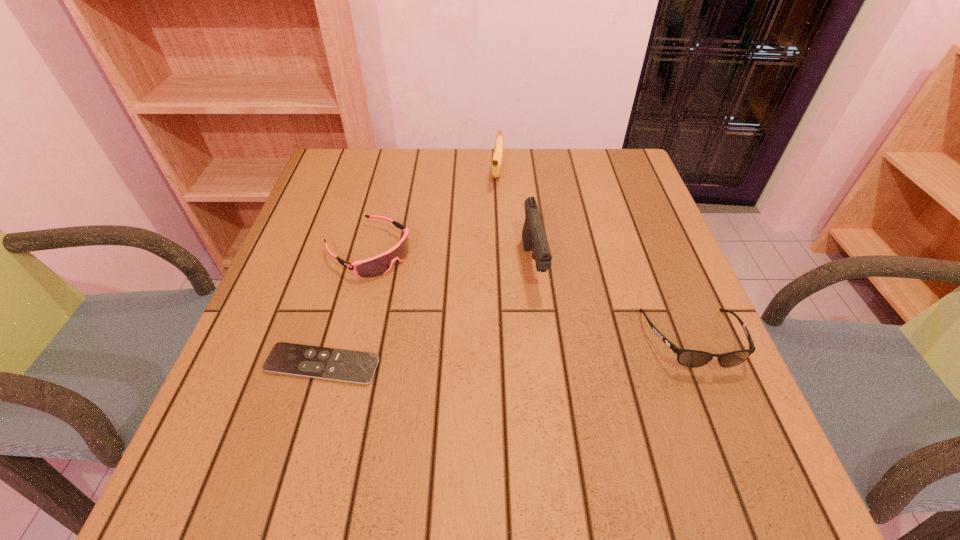
Locate an element on the screen. vacant spot on the desktop that is between the shortest object and the rightmost object and is positioned on the front-facing side of the goggles is located at coordinates (516, 352).

Find the location of a particular element. free spot on the desktop that is between the remote control and the sunglasses and is positioned at the barrel of the second object from right to left is located at coordinates (553, 349).

In order to click on free space on the desktop that is between the remote control and the sunglasses and is positioned at the stem of the banana in this screenshot , I will do `click(471, 355)`.